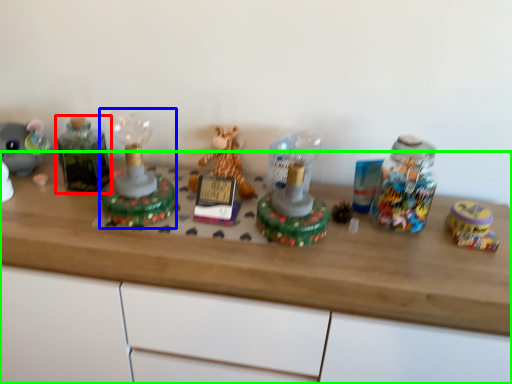
Question: Estimate the real-world distances between objects in this image. Which object is closer to bottle (highlighted by a red box), toy (highlighted by a blue box) or desk (highlighted by a green box)?

Choices:
 (A) toy
 (B) desk

Answer: (A)